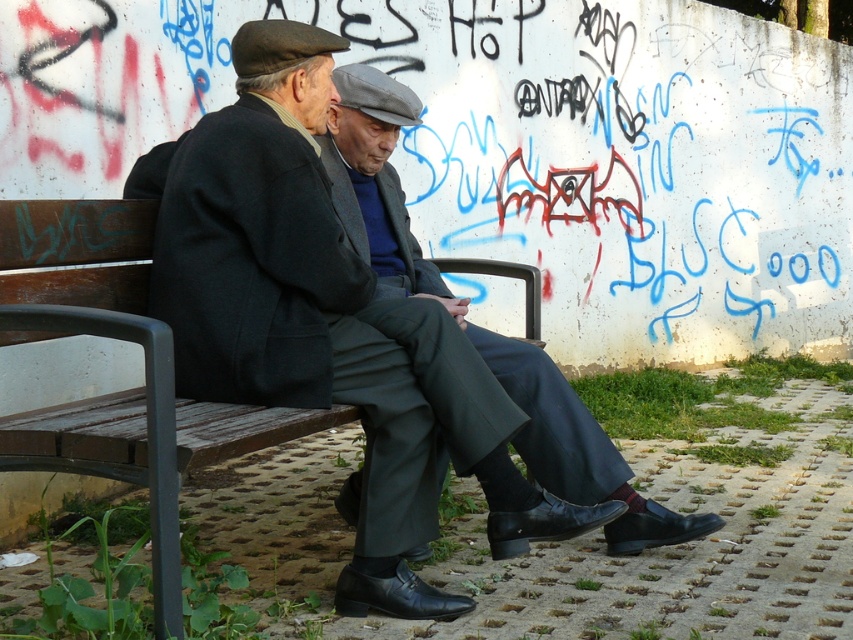
Who is positioned more to the left, matte black suit at center or wooden bench at center?

wooden bench at center

Is the position of matte black suit at center less distant than that of wooden bench at center?

No, it is behind wooden bench at center.

This screenshot has width=853, height=640. Describe the element at coordinates (328, 323) in the screenshot. I see `matte black suit at center` at that location.

Locate an element on the screen. The height and width of the screenshot is (640, 853). matte black suit at center is located at coordinates (328, 323).

In the scene shown: Is wooden bench at center behind dark gray wool suit at center?

No, it is not.

Which of these two, wooden bench at center or dark gray wool suit at center, stands taller?

With more height is dark gray wool suit at center.

The image size is (853, 640). In order to click on wooden bench at center in this screenshot , I will do `click(120, 390)`.

Locate an element on the screen. wooden bench at center is located at coordinates click(x=120, y=390).

Can you confirm if matte black suit at center is positioned to the right of dark gray wool suit at center?

No, matte black suit at center is not to the right of dark gray wool suit at center.

Can you confirm if matte black suit at center is taller than dark gray wool suit at center?

Yes.

At what (x,y) coordinates should I click in order to perform the action: click on matte black suit at center. Please return your answer as a coordinate pair (x, y). Looking at the image, I should click on (328, 323).

What are the coordinates of `matte black suit at center` in the screenshot? It's located at (328, 323).